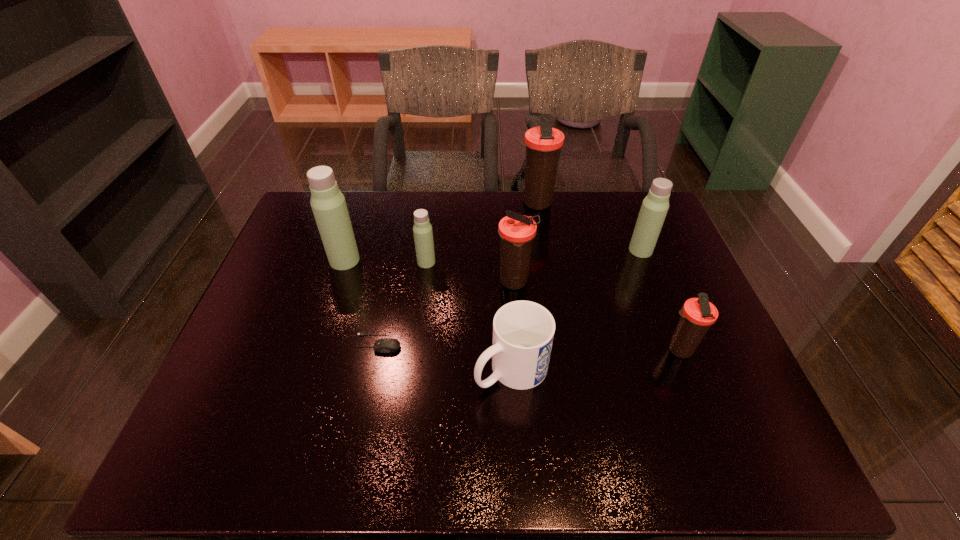
This screenshot has height=540, width=960. I want to click on thermos bottle that is the closest to the biggest brown thermos bottle, so click(x=655, y=205).

Find the location of a particular element. thermos bottle that is the third closest to the second farthest brown thermos bottle is located at coordinates (655, 205).

You are a GUI agent. You are given a task and a screenshot of the screen. Output one action in this format:
    pyautogui.click(x=<x>, y=<y>)
    Task: Click on the second closest brown thermos bottle to the mug
    The height and width of the screenshot is (540, 960).
    Given the screenshot: What is the action you would take?
    pyautogui.click(x=697, y=314)

You are a GUI agent. You are given a task and a screenshot of the screen. Output one action in this format:
    pyautogui.click(x=<x>, y=<y>)
    Task: Click on the brown thermos bottle that can be found as the second closest to the fifth thermos bottle from right to left
    This screenshot has height=540, width=960.
    Given the screenshot: What is the action you would take?
    pyautogui.click(x=543, y=144)

Identify which light thermos bottle is located as the second nearest to the smallest brown thermos bottle. Please provide its 2D coordinates. Your answer should be formatted as a tuple, i.e. [(x, y)], where the tuple contains the x and y coordinates of a point satisfying the conditions above.

[(423, 235)]

You are a GUI agent. You are given a task and a screenshot of the screen. Output one action in this format:
    pyautogui.click(x=<x>, y=<y>)
    Task: Click on the light thermos bottle identified as the second closest to the leftmost thermos bottle
    The height and width of the screenshot is (540, 960).
    Given the screenshot: What is the action you would take?
    pyautogui.click(x=655, y=205)

You are a GUI agent. You are given a task and a screenshot of the screen. Output one action in this format:
    pyautogui.click(x=<x>, y=<y>)
    Task: Click on the free space that satisfies the following two spatial constraints: 1. on the front side of the leftmost thermos bottle; 2. on the right side of the mouse
    The width and height of the screenshot is (960, 540).
    Given the screenshot: What is the action you would take?
    click(318, 343)